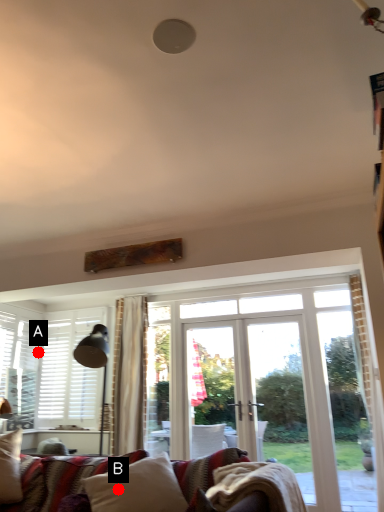
Question: Two points are circled on the image, labeled by A and B beside each circle. Which point is closer to the camera taking this photo?

Choices:
 (A) A is closer
 (B) B is closer

Answer: (B)